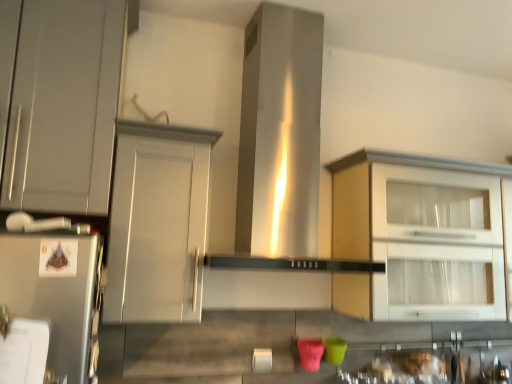
Question: Can matte gray cabinet at center, positioned as the second cabinetry in right-to-left order, be found inside matte gray cabinet at left, which ranks as the 3th cabinetry in right-to-left order?

Choices:
 (A) yes
 (B) no

Answer: (B)

Question: Can you confirm if matte gray cabinet at left, the first cabinetry from the left, is shorter than matte gray cabinet at center, positioned as the second cabinetry in right-to-left order?

Choices:
 (A) yes
 (B) no

Answer: (B)

Question: Does matte gray cabinet at left, which ranks as the 3th cabinetry in right-to-left order, appear on the left side of matte gray cabinet at center, positioned as the 2th cabinetry in left-to-right order?

Choices:
 (A) yes
 (B) no

Answer: (A)

Question: Would you say matte gray cabinet at left, which ranks as the 3th cabinetry in right-to-left order, is a long distance from matte gray cabinet at center, positioned as the second cabinetry in right-to-left order?

Choices:
 (A) no
 (B) yes

Answer: (A)

Question: Is matte gray cabinet at left, which ranks as the 3th cabinetry in right-to-left order, positioned beyond the bounds of matte gray cabinet at center, positioned as the second cabinetry in right-to-left order?

Choices:
 (A) yes
 (B) no

Answer: (A)

Question: Can you confirm if matte gray cabinet at left, which ranks as the 3th cabinetry in right-to-left order, is taller than matte gray cabinet at center, positioned as the second cabinetry in right-to-left order?

Choices:
 (A) yes
 (B) no

Answer: (A)

Question: From a real-world perspective, is matte white cabinet at right, placed as the 3th cabinetry when sorted from left to right, located higher than stainless steel vent at center?

Choices:
 (A) no
 (B) yes

Answer: (A)

Question: Can you confirm if matte white cabinet at right, placed as the 3th cabinetry when sorted from left to right, is bigger than stainless steel vent at center?

Choices:
 (A) yes
 (B) no

Answer: (B)

Question: Is matte white cabinet at right, which is the first cabinetry from right to left, in front of stainless steel vent at center?

Choices:
 (A) no
 (B) yes

Answer: (A)

Question: Is matte white cabinet at right, placed as the 3th cabinetry when sorted from left to right, to the left of stainless steel vent at center from the viewer's perspective?

Choices:
 (A) no
 (B) yes

Answer: (A)

Question: From the image's perspective, is matte white cabinet at right, placed as the 3th cabinetry when sorted from left to right, located above stainless steel vent at center?

Choices:
 (A) yes
 (B) no

Answer: (B)

Question: Does matte white cabinet at right, which is the first cabinetry from right to left, have a smaller size compared to stainless steel vent at center?

Choices:
 (A) yes
 (B) no

Answer: (A)

Question: Would you say matte gray cabinet at center, positioned as the second cabinetry in right-to-left order, contains matte white cabinet at right, which is the first cabinetry from right to left?

Choices:
 (A) yes
 (B) no

Answer: (B)